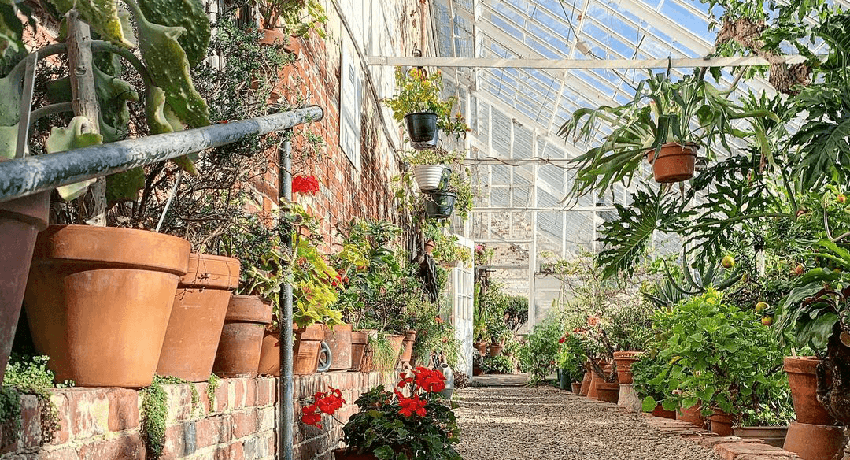
Identify the location of black metallic railing. The height and width of the screenshot is (460, 850). (121, 154).